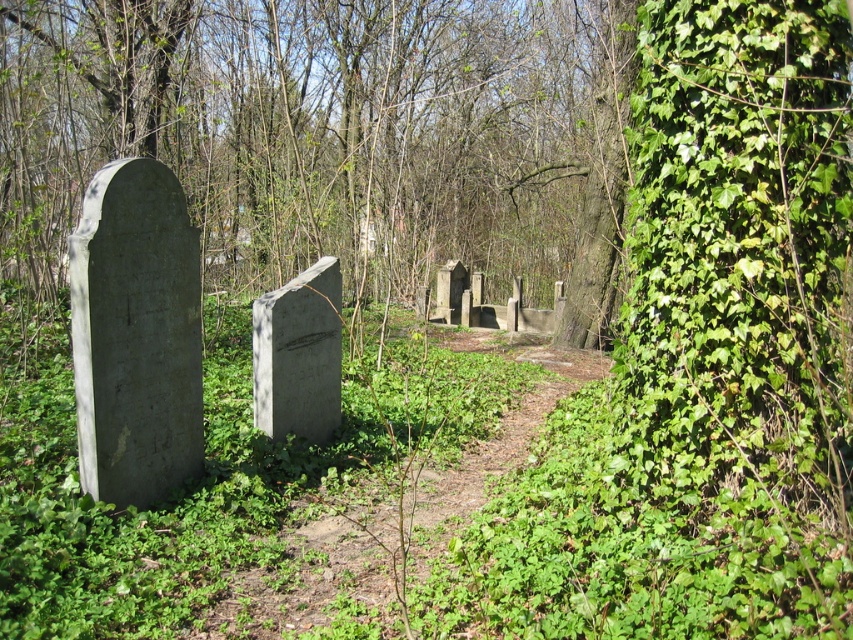
Is green ivy at right thinner than gray stone gravestone at left?

In fact, green ivy at right might be wider than gray stone gravestone at left.

You are a GUI agent. You are given a task and a screenshot of the screen. Output one action in this format:
    pyautogui.click(x=<x>, y=<y>)
    Task: Click on the green ivy at right
    This screenshot has width=853, height=640.
    Given the screenshot: What is the action you would take?
    pyautogui.click(x=332, y=134)

The height and width of the screenshot is (640, 853). In order to click on green ivy at right in this screenshot , I will do `click(332, 134)`.

From the picture: Who is shorter, gray stone gravestone at left or gray stone gravestone at center?

gray stone gravestone at center is shorter.

Can you confirm if gray stone gravestone at left is positioned to the right of gray stone gravestone at center?

No, gray stone gravestone at left is not to the right of gray stone gravestone at center.

Between point (184, 340) and point (321, 275), which one is positioned in front?

Positioned in front is point (184, 340).

At what (x,y) coordinates should I click in order to perform the action: click on gray stone gravestone at left. Please return your answer as a coordinate pair (x, y). This screenshot has height=640, width=853. Looking at the image, I should click on (135, 333).

Based on the photo, can you confirm if green ivy at right is shorter than gray stone gravestone at center?

No.

How far apart are green ivy at right and gray stone gravestone at center?

green ivy at right and gray stone gravestone at center are 4.63 meters apart.

The width and height of the screenshot is (853, 640). In order to click on green ivy at right in this screenshot , I will do `click(332, 134)`.